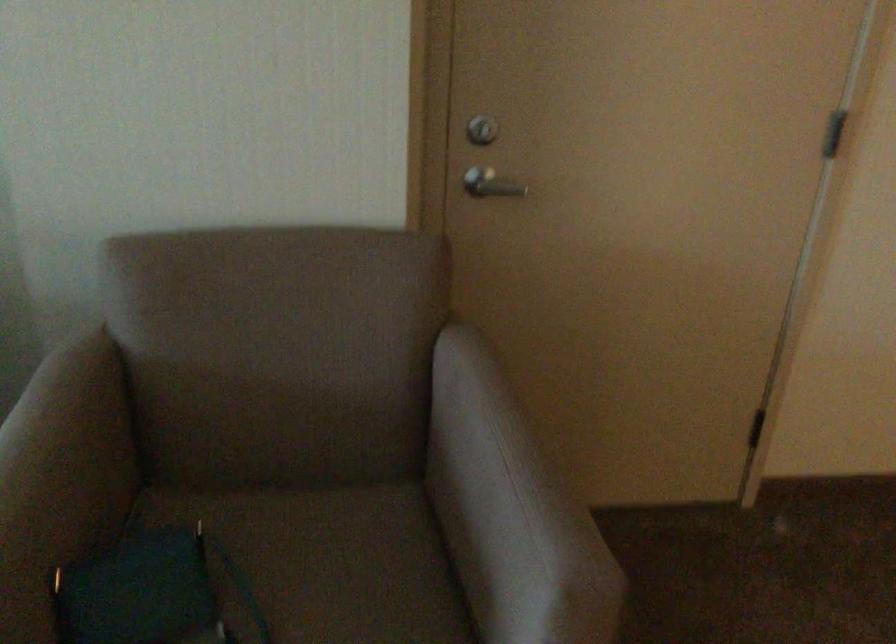
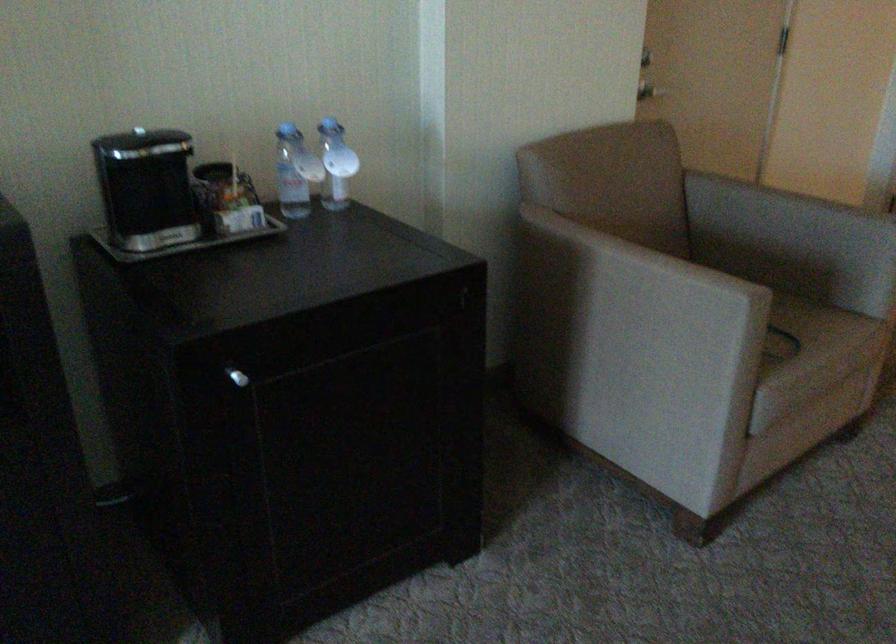
In the second image, find the point that corresponds to [478,205] in the first image.

(649, 90)